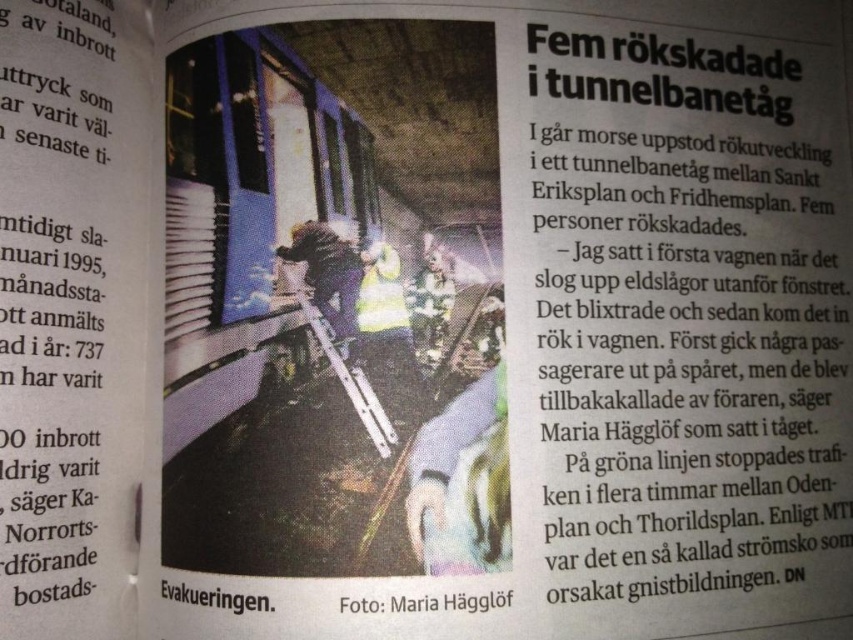
Question: Which object appears closest to the camera in this image?

Choices:
 (A) blacktextured fabricphoto at center
 (B) white paper at upper center
 (C) black paper at lower center

Answer: (A)

Question: Is white paper at upper center to the left of blacktextured fabricphoto at center from the viewer's perspective?

Choices:
 (A) no
 (B) yes

Answer: (A)

Question: Which point is farther to the camera?

Choices:
 (A) black paper at lower center
 (B) blacktextured fabricphoto at center
 (C) white paper at upper center

Answer: (C)

Question: Is white paper at upper center positioned before black paper at lower center?

Choices:
 (A) yes
 (B) no

Answer: (B)

Question: Which object is positioned closest to the black paper at lower center?

Choices:
 (A) blacktextured fabricphoto at center
 (B) white paper at upper center

Answer: (A)

Question: Is white paper at upper center thinner than black paper at lower center?

Choices:
 (A) yes
 (B) no

Answer: (B)